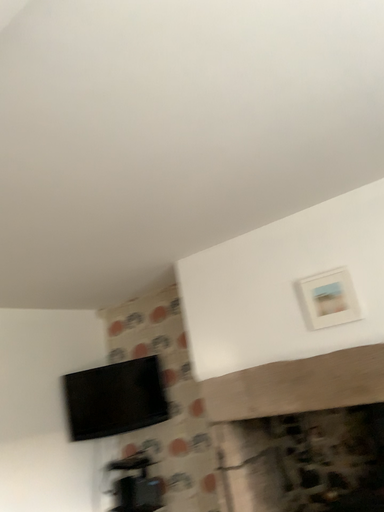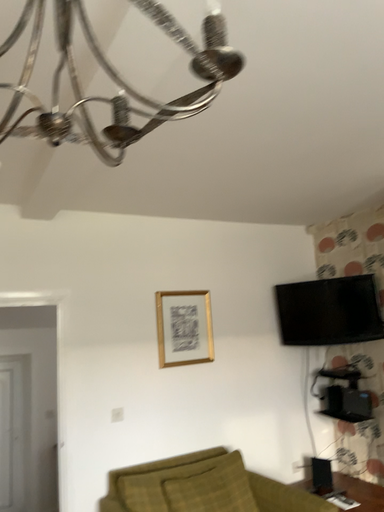
Question: Which way did the camera rotate in the video?

Choices:
 (A) rotated right
 (B) rotated left

Answer: (B)